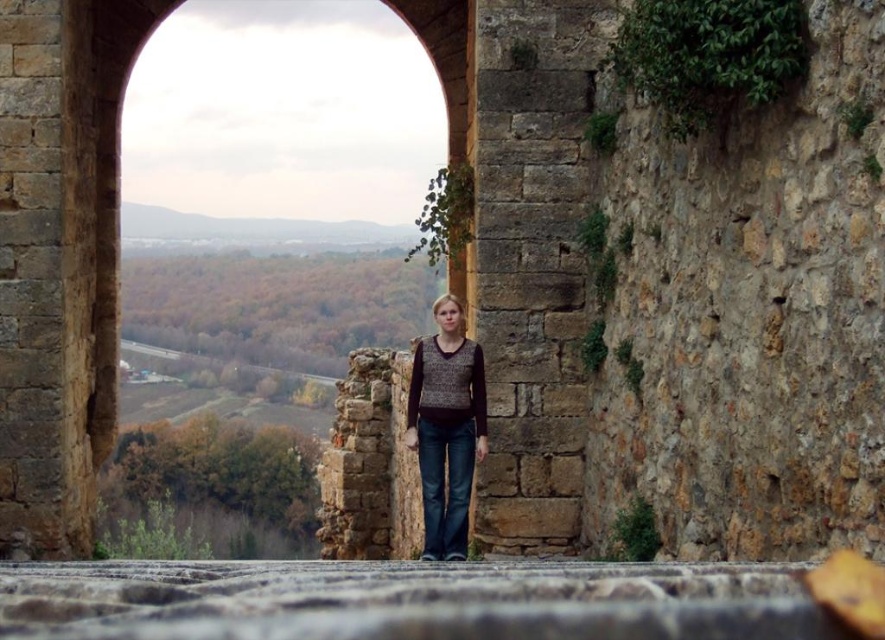
Question: Does stone archway at center come in front of knit sweater at center?

Choices:
 (A) no
 (B) yes

Answer: (A)

Question: Is stone archway at center positioned in front of knit sweater at center?

Choices:
 (A) no
 (B) yes

Answer: (A)

Question: Is stone archway at center below knit sweater at center?

Choices:
 (A) no
 (B) yes

Answer: (A)